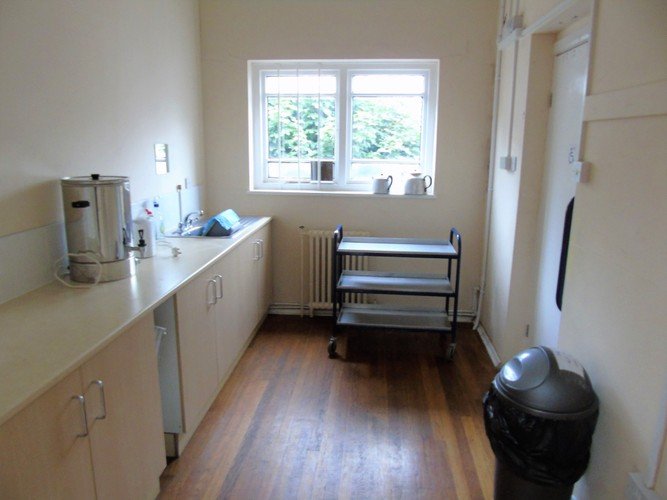
At what (x,y) coordinates should I click in order to perform the action: click on trolley cart. Please return your answer as a coordinate pair (x, y). The image size is (667, 500). Looking at the image, I should click on (378, 318), (397, 281), (410, 242), (335, 243), (457, 279).